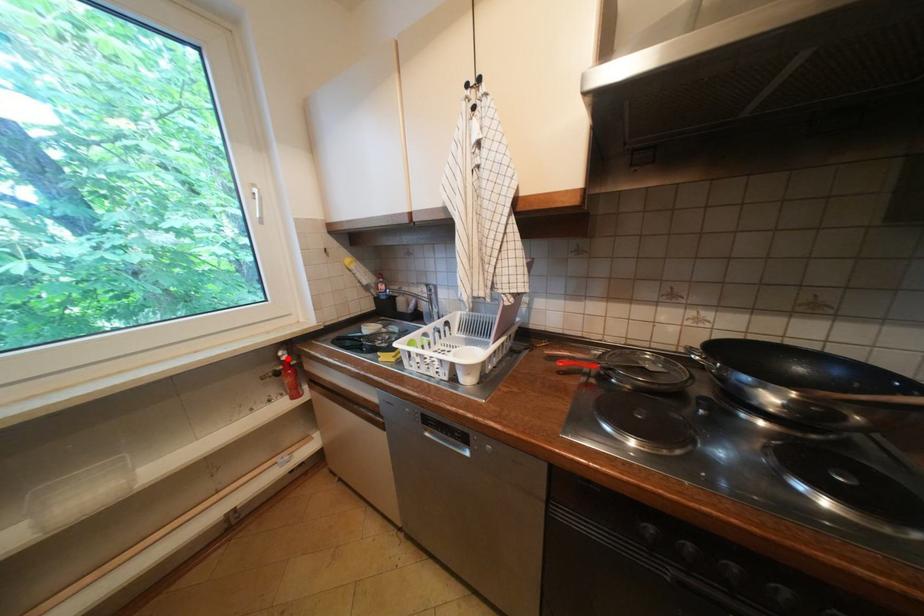
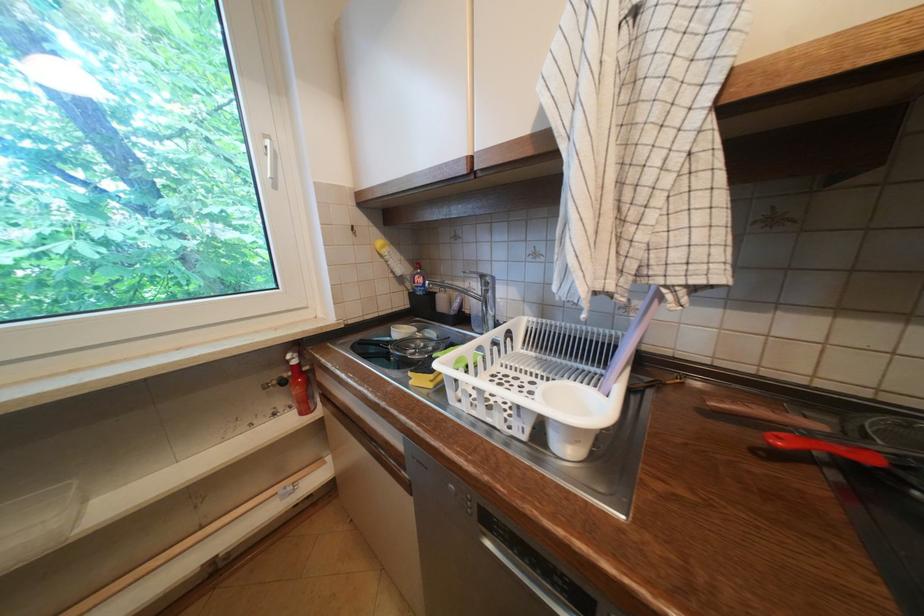
Locate, in the second image, the point that corresponds to the highlighted location in the first image.

(296, 362)